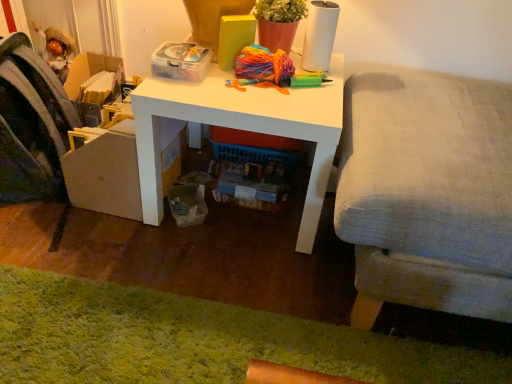
Question: Based on their sizes in the image, would you say light gray fabric couch at right is bigger or smaller than transparent plastic storage box at upper center?

Choices:
 (A) small
 (B) big

Answer: (B)

Question: Considering the positions of light gray fabric couch at right and transparent plastic storage box at upper center in the image, is light gray fabric couch at right taller or shorter than transparent plastic storage box at upper center?

Choices:
 (A) short
 (B) tall

Answer: (B)

Question: Estimate the real-world distances between objects in this image. Which object is closer to the light gray fabric couch at right?

Choices:
 (A) velvet fabric swivel chair at left
 (B) transparent plastic storage box at upper center
 (C) green shaggy rug at lower left
 (D) white matte desk at center

Answer: (D)

Question: Estimate the real-world distances between objects in this image. Which object is closer to the velvet fabric swivel chair at left?

Choices:
 (A) green shaggy rug at lower left
 (B) transparent plastic storage box at upper center
 (C) white matte desk at center
 (D) light gray fabric couch at right

Answer: (B)